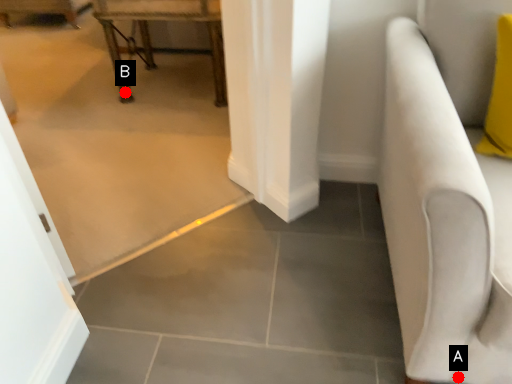
Question: Two points are circled on the image, labeled by A and B beside each circle. Which point is farther from the camera taking this photo?

Choices:
 (A) A is further
 (B) B is further

Answer: (B)